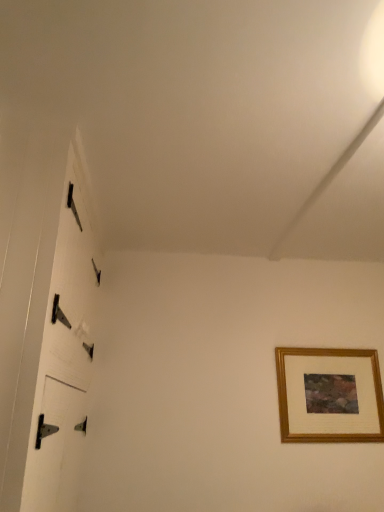
Question: Looking at the image, does gold wooden picture frame at lower right seem bigger or smaller compared to metallic hinges at left?

Choices:
 (A) big
 (B) small

Answer: (B)

Question: In the image, is gold wooden picture frame at lower right positioned in front of or behind metallic hinges at left?

Choices:
 (A) front
 (B) behind

Answer: (B)

Question: Considering the relative positions of gold wooden picture frame at lower right and metallic hinges at left in the image provided, is gold wooden picture frame at lower right to the left or to the right of metallic hinges at left?

Choices:
 (A) right
 (B) left

Answer: (A)

Question: From the image's perspective, relative to gold wooden picture frame at lower right, is metallic hinges at left above or below?

Choices:
 (A) above
 (B) below

Answer: (A)

Question: Considering the positions of metallic hinges at left and gold wooden picture frame at lower right in the image, is metallic hinges at left wider or thinner than gold wooden picture frame at lower right?

Choices:
 (A) wide
 (B) thin

Answer: (A)

Question: Is metallic hinges at left to the left or to the right of gold wooden picture frame at lower right in the image?

Choices:
 (A) left
 (B) right

Answer: (A)

Question: Is metallic hinges at left taller or shorter than gold wooden picture frame at lower right?

Choices:
 (A) tall
 (B) short

Answer: (A)